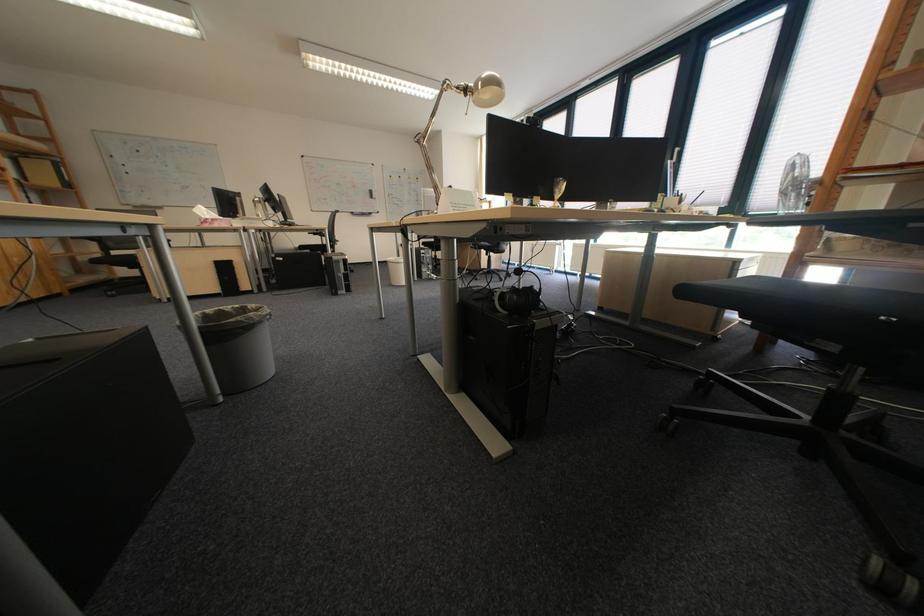
This screenshot has height=616, width=924. I want to click on white tissue box, so click(210, 217).